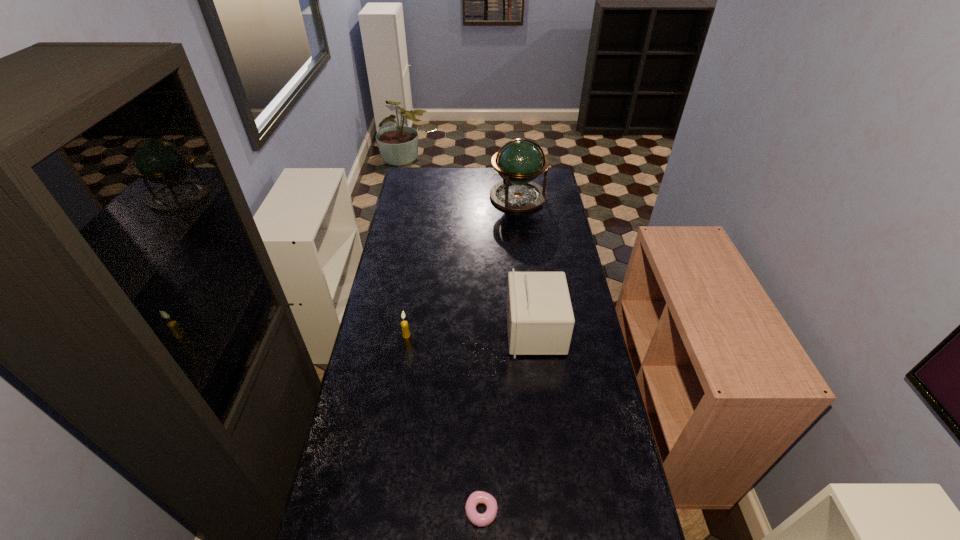
Where is `unoccupied position between the leftmost object and the first-aid kit`? unoccupied position between the leftmost object and the first-aid kit is located at coordinates (470, 333).

Choose which object is the nearest neighbor to the shortest object. Please provide its 2D coordinates. Your answer should be formatted as a tuple, i.e. [(x, y)], where the tuple contains the x and y coordinates of a point satisfying the conditions above.

[(540, 320)]

Identify which object is the nearest to the leftmost object. Please provide its 2D coordinates. Your answer should be formatted as a tuple, i.e. [(x, y)], where the tuple contains the x and y coordinates of a point satisfying the conditions above.

[(540, 320)]